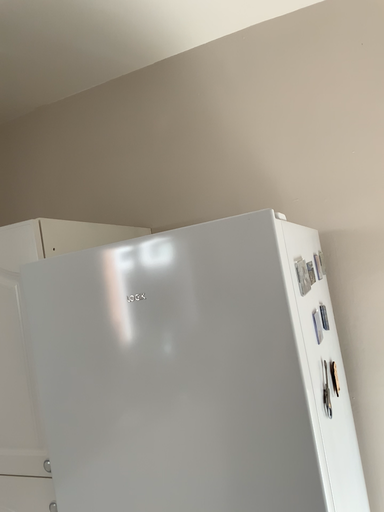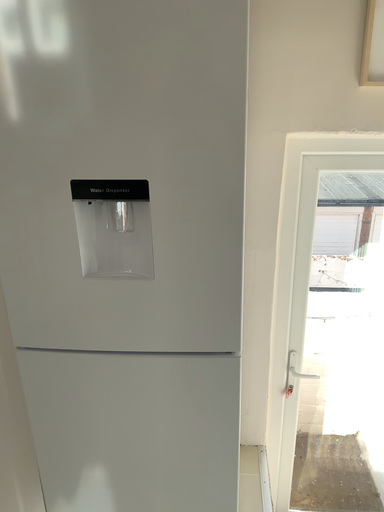
Question: Which way did the camera rotate in the video?

Choices:
 (A) rotated downward
 (B) rotated upward

Answer: (A)